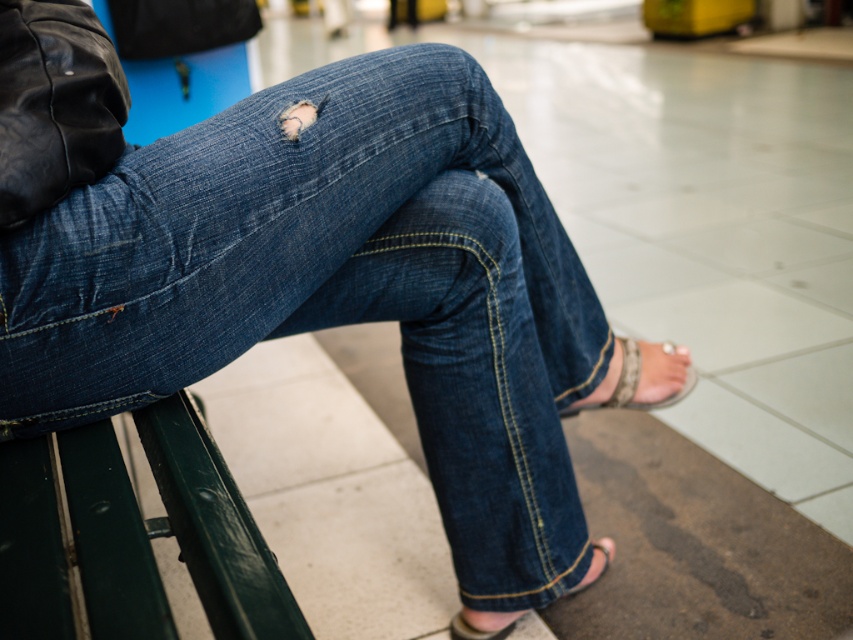
You are a tailor who needs to determine if the pink fabric sandal at lower right can be placed on the denim at left without overlapping. Based on their widths, is this possible?

The denim at left is wider than the pink fabric sandal at lower right, so yes, the pink fabric sandal at lower right can be placed on the denim at left without overlapping.

You are a photographer trying to capture a close detail shot of the sandals on the person sitting on the green bench. Since both the leather textured sandal at lower right and the pink fabric sandal at lower right are in the frame, which one should you focus on if you want to capture the one that is positioned to the right side of the other?

The leather textured sandal at lower right is positioned to the right of the pink fabric sandal at lower right, so you should focus on the leather textured sandal at lower right to capture the one on the right side.